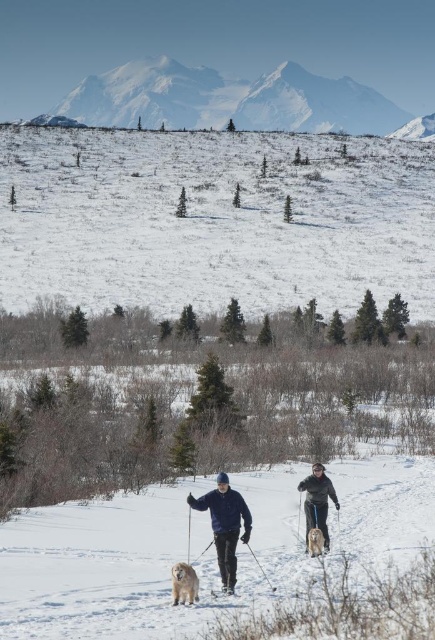
You are a drone operator tasked with capturing aerial footage of the winter scene. The director wants to focus on the white powdery snow at upper center. Given that the drone is currently hovering at point (214,221), which is the location of the white powdery snow at upper center, can you confirm if the drone is already positioned correctly?

Yes, the drone is already positioned correctly because point (214,221) corresponds to the white powdery snow at upper center.

You are standing at the starting point of a cross country skiing trail and see two points marked on the map. The first point is at coordinates point (170, 61) and the second point is at point (214, 508). Which point is closer to you?

Point (170, 61) is closer to you because it is further to the viewer than point (214, 508).

You are a photographer planning to take a photo of the snowy mountain range at upper center and the blue fleece jacket at center. To ensure both are in focus, you need to know their relative positions. Which object is higher in the image?

The snowy mountain range at upper center is above the blue fleece jacket at center, so it is higher in the image.